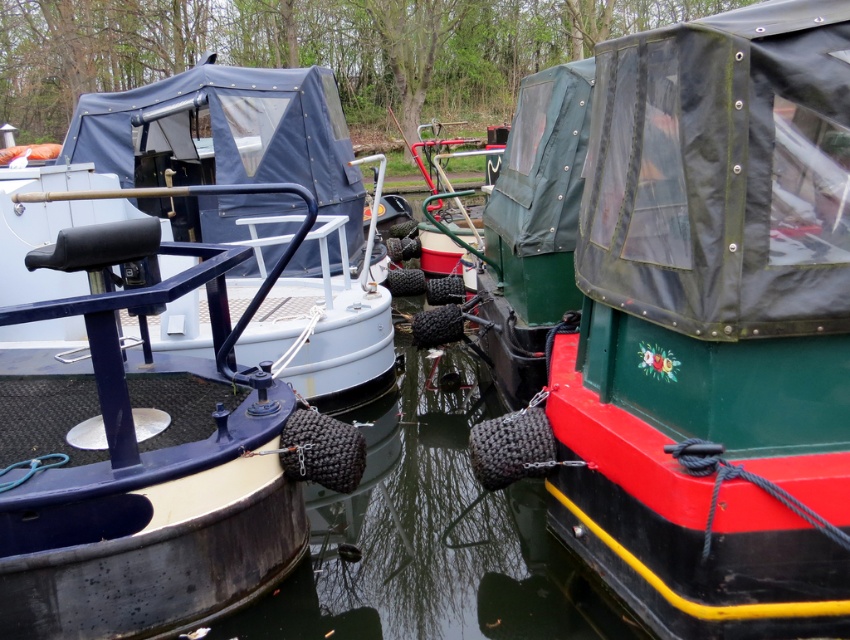
In the scene shown: Please provide the exact coordinates of the green glossy boat at center in the image. The answer should be in the format of a coordinate pair in parentheses, like this example format. Please do not add any extra text or explanation.

The green glossy boat at center is located at coordinates point (x=711, y=326).

You are a visitor standing on the dock and want to board the green glossy boat at center. You notice a smooth rubber fender at center nearby. Is the fender located below or above the boat?

The green glossy boat at center is above the smooth rubber fender at center, so the fender is located below the boat.

You are a dock inspector checking the safety of the moored boats. You notice the smooth rubber fender at center and the matte blue boat at left. Which object has a lower height according to the description?

The smooth rubber fender at center has a lesser height compared to the matte blue boat at left, so the smooth rubber fender at center is lower in height.